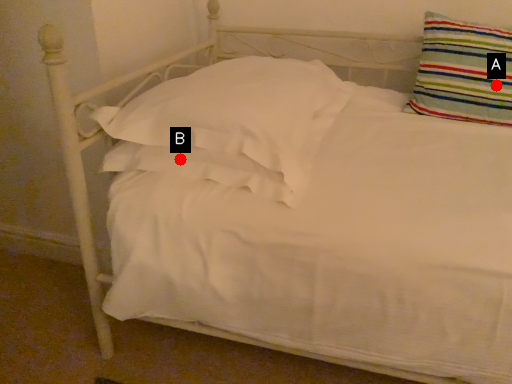
Question: Two points are circled on the image, labeled by A and B beside each circle. Which of the following is the farthest from the observer?

Choices:
 (A) A is further
 (B) B is further

Answer: (A)